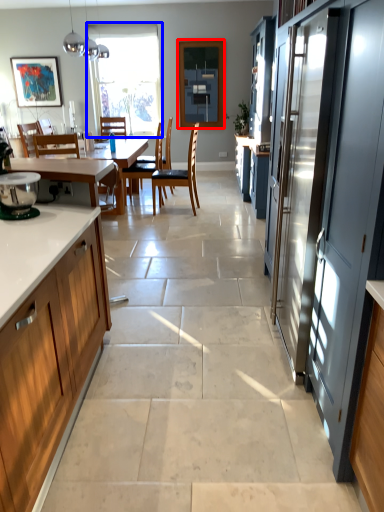
Question: Among these objects, which one is nearest to the camera, window screen (highlighted by a red box) or window (highlighted by a blue box)?

Choices:
 (A) window screen
 (B) window

Answer: (A)